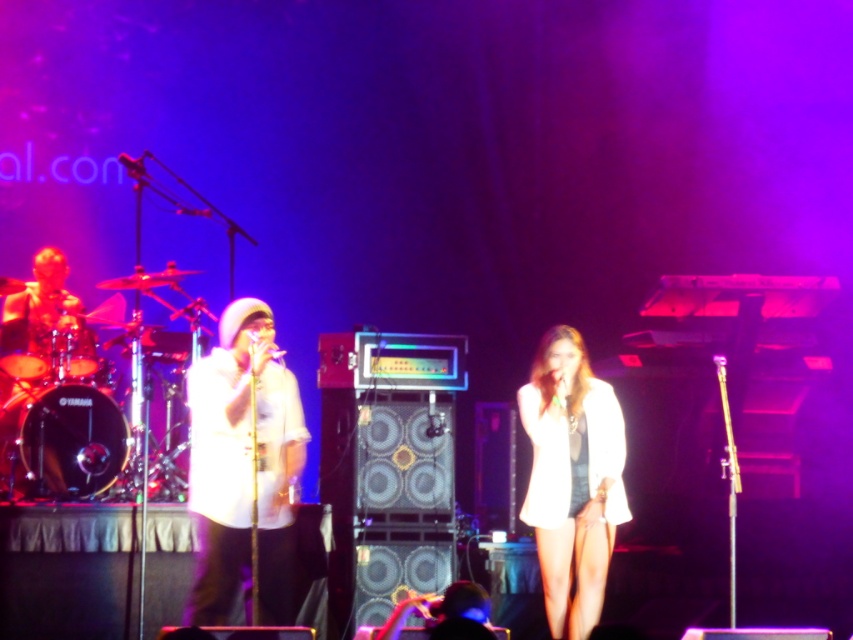
You are a photographer positioned at the back of the stage. You need to capture a closeup shot of both the white matte shirt at center and the white fabric dress at center without any overlap. Given that your camera has a fixed focal length, which performer should you move closer to and why?

You should move closer to the white fabric dress at center because its width is narrower than the white matte shirt at center. By moving closer to the narrower dress, you can ensure both subjects fit within the frame without overlapping while maintaining focus on both.

You are a photographer positioned at the back of the stage. You want to take a photo of both the white matte shirt at center and the white fabric dress at center without any obstruction. Since you can only adjust your camera angle slightly, which performer should you focus on first to ensure both are visible?

The white matte shirt at center is in front of the white fabric dress at center, so you should focus on the white fabric dress at center first to ensure it is visible behind the white matte shirt at center.

You are a stagehand preparing to place a spotlight on the stage. You have two points marked on the stage floor at coordinates point (287, 588) and point (581, 516). According to the scene, which point is closer to the audience?

Point (287, 588) is behind point (581, 516), so point (581, 516) is closer to the audience.